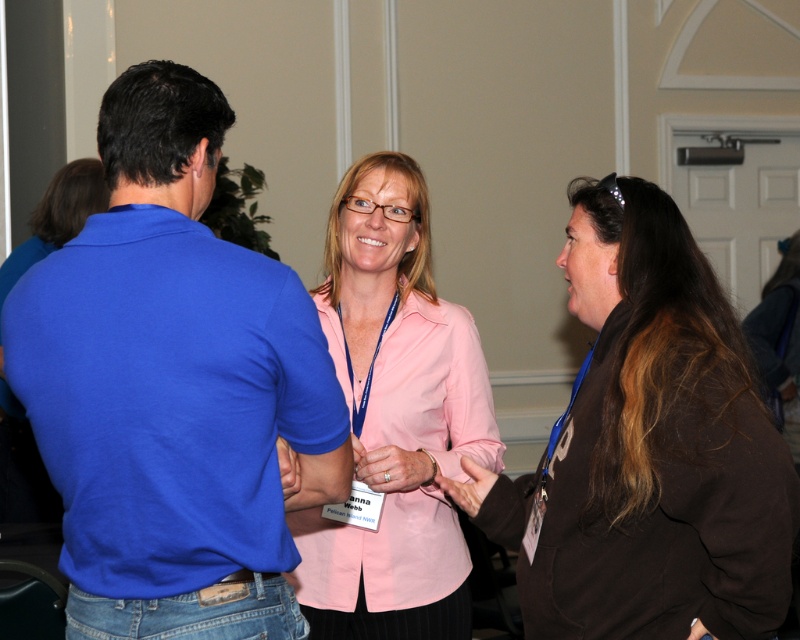
Question: Which is nearer to the pink fabric shirt at center?

Choices:
 (A) brown soft fabric shirt at center
 (B) blue cotton polo shirt at left

Answer: (A)

Question: Can you confirm if blue cotton polo shirt at left is positioned to the left of pink fabric shirt at center?

Choices:
 (A) no
 (B) yes

Answer: (B)

Question: Among these objects, which one is farthest from the camera?

Choices:
 (A) blue cotton polo shirt at left
 (B) pink fabric shirt at center
 (C) brown soft fabric shirt at center

Answer: (B)

Question: Can you confirm if blue cotton polo shirt at left is positioned to the right of brown soft fabric shirt at center?

Choices:
 (A) yes
 (B) no

Answer: (B)

Question: Can you confirm if brown soft fabric shirt at center is thinner than pink fabric shirt at center?

Choices:
 (A) no
 (B) yes

Answer: (A)

Question: Among these objects, which one is farthest from the camera?

Choices:
 (A) blue cotton polo shirt at left
 (B) pink fabric shirt at center

Answer: (B)